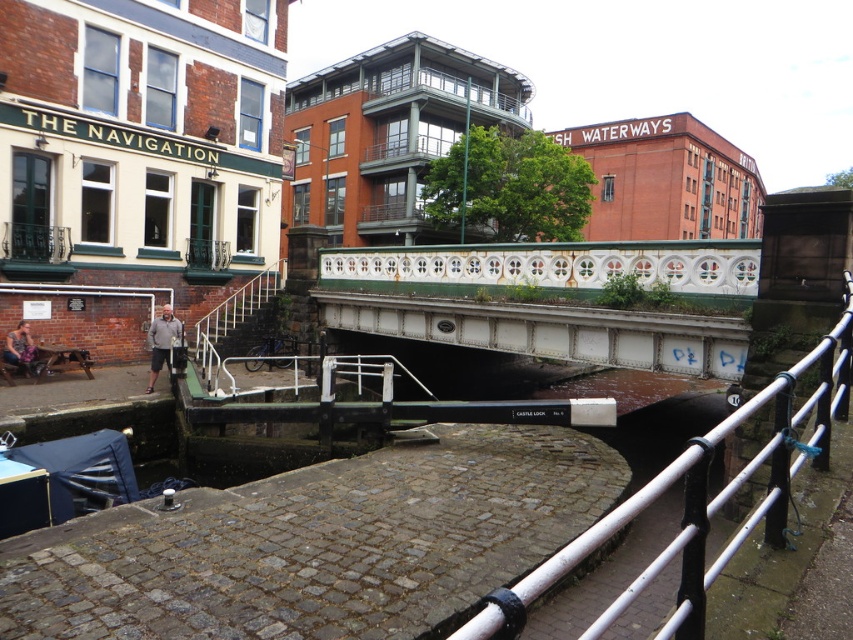
You are a tourist standing on the cobblestone pathway and want to cross to the other side of the canal. There are two white structures in front of you. One is the white painted metal bridge at center and the other is the white metal railing at center. Which one should you walk towards to safely cross the canal?

You should walk towards the white painted metal bridge at center because it is positioned on the left side of the white metal railing at center, making it the structure that spans over the canal for safe crossing.

You are standing on the cobblestone pathway and see the white metal railing at center and the gray fabric pants at lower left. Which object is positioned higher from the ground?

The white metal railing at center is located above the gray fabric pants at lower left, so it is positioned higher from the ground.

You are standing at the cobblestone pathway in the canal lock area. You see a point marked at coordinates point (699, 499). According to the scene, where exactly is this point located?

The point (699, 499) is located on the white metal railing at center.